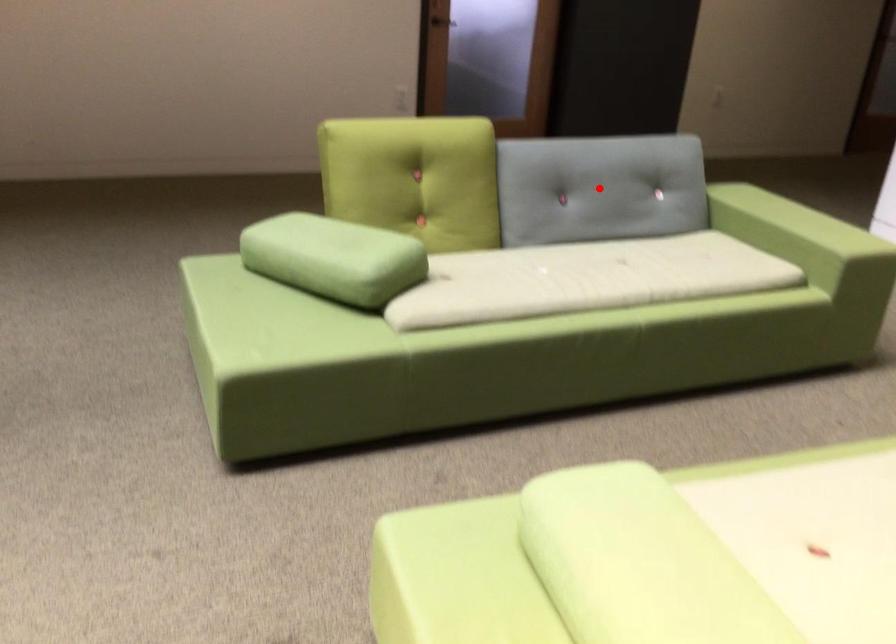
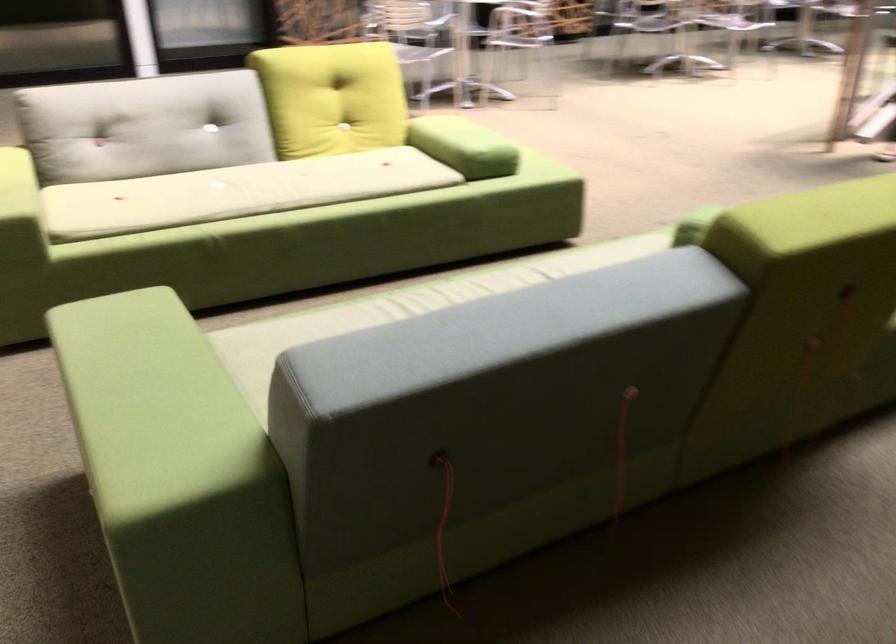
Question: I am providing you with two images of the same scene from different viewpoints. A red point is marked on the first image. Can you still see the location of the red point in image 2?

Choices:
 (A) Yes
 (B) No

Answer: (B)